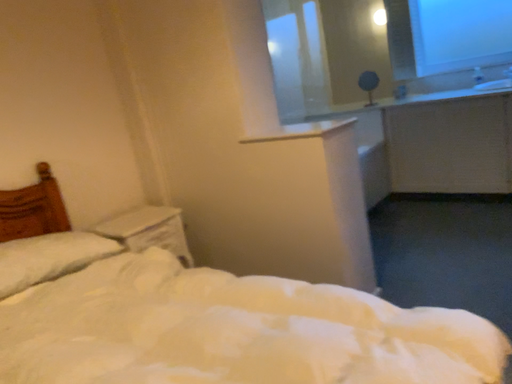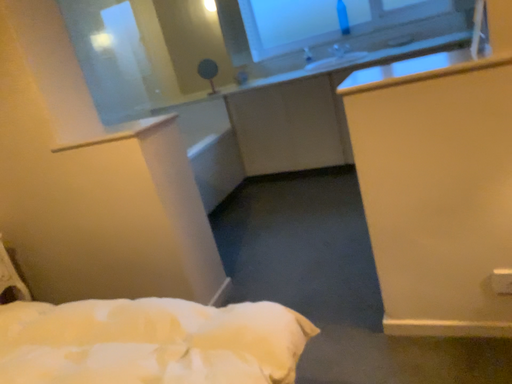
Question: How did the camera likely rotate when shooting the video?

Choices:
 (A) rotated left
 (B) rotated right

Answer: (B)